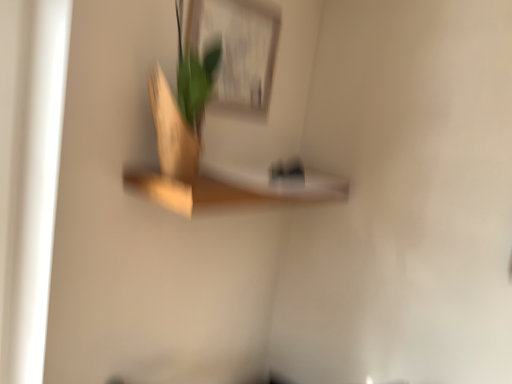
Question: From a real-world perspective, is wooden shelf at center below matte white picture frame at upper center?

Choices:
 (A) no
 (B) yes

Answer: (B)

Question: Considering the relative sizes of wooden shelf at center and matte white picture frame at upper center in the image provided, is wooden shelf at center shorter than matte white picture frame at upper center?

Choices:
 (A) yes
 (B) no

Answer: (A)

Question: Is wooden shelf at center oriented towards matte white picture frame at upper center?

Choices:
 (A) yes
 (B) no

Answer: (B)

Question: Does wooden shelf at center have a smaller size compared to matte white picture frame at upper center?

Choices:
 (A) yes
 (B) no

Answer: (B)

Question: Considering the relative sizes of wooden shelf at center and matte white picture frame at upper center in the image provided, is wooden shelf at center bigger than matte white picture frame at upper center?

Choices:
 (A) yes
 (B) no

Answer: (A)

Question: Is wooden shelf at center touching matte white picture frame at upper center?

Choices:
 (A) no
 (B) yes

Answer: (A)

Question: Considering the relative sizes of matte white picture frame at upper center and wooden shelf at center in the image provided, is matte white picture frame at upper center bigger than wooden shelf at center?

Choices:
 (A) yes
 (B) no

Answer: (B)

Question: Considering the relative sizes of matte white picture frame at upper center and wooden shelf at center in the image provided, is matte white picture frame at upper center thinner than wooden shelf at center?

Choices:
 (A) yes
 (B) no

Answer: (A)

Question: Is matte white picture frame at upper center closer to camera compared to wooden shelf at center?

Choices:
 (A) no
 (B) yes

Answer: (A)

Question: Is matte white picture frame at upper center beside wooden shelf at center?

Choices:
 (A) yes
 (B) no

Answer: (B)

Question: Considering the relative sizes of matte white picture frame at upper center and wooden shelf at center in the image provided, is matte white picture frame at upper center smaller than wooden shelf at center?

Choices:
 (A) no
 (B) yes

Answer: (B)

Question: Is matte white picture frame at upper center to the left of wooden shelf at center from the viewer's perspective?

Choices:
 (A) no
 (B) yes

Answer: (B)

Question: In terms of width, does matte white picture frame at upper center look wider or thinner when compared to wooden shelf at center?

Choices:
 (A) thin
 (B) wide

Answer: (A)